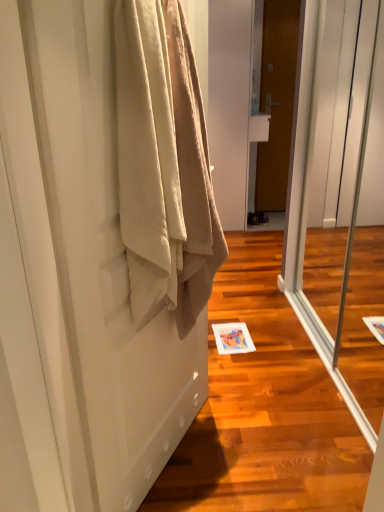
Locate an element on the screen. This screenshot has height=512, width=384. vacant area that lies between beige fabric door at left, which is the first door in left-to-right order, and transparent glass screen door at center is located at coordinates (278, 404).